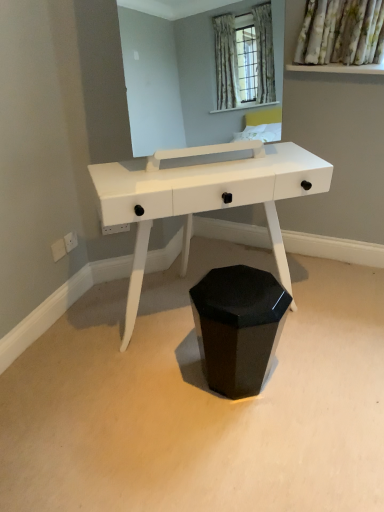
Question: Does white glossy table at center appear on the right side of black glossy hexagonal waste bin at center?

Choices:
 (A) yes
 (B) no

Answer: (B)

Question: Is white glossy table at center outside black glossy hexagonal waste bin at center?

Choices:
 (A) no
 (B) yes

Answer: (B)

Question: From the image's perspective, is white glossy table at center on black glossy hexagonal waste bin at center?

Choices:
 (A) yes
 (B) no

Answer: (A)

Question: Is white glossy table at center oriented away from black glossy hexagonal waste bin at center?

Choices:
 (A) yes
 (B) no

Answer: (B)

Question: Is black glossy hexagonal waste bin at center surrounded by white glossy table at center?

Choices:
 (A) yes
 (B) no

Answer: (B)

Question: Can you confirm if white glossy table at center is bigger than black glossy hexagonal waste bin at center?

Choices:
 (A) no
 (B) yes

Answer: (B)

Question: Considering the relative positions of black glossy hexagonal waste bin at center and white glossy table at center in the image provided, is black glossy hexagonal waste bin at center to the right of white glossy table at center from the viewer's perspective?

Choices:
 (A) yes
 (B) no

Answer: (A)

Question: From a real-world perspective, is black glossy hexagonal waste bin at center located higher than white glossy table at center?

Choices:
 (A) no
 (B) yes

Answer: (A)

Question: From a real-world perspective, is black glossy hexagonal waste bin at center beneath white glossy table at center?

Choices:
 (A) yes
 (B) no

Answer: (A)

Question: Considering the relative positions of black glossy hexagonal waste bin at center and white glossy table at center in the image provided, is black glossy hexagonal waste bin at center to the left of white glossy table at center from the viewer's perspective?

Choices:
 (A) yes
 (B) no

Answer: (B)

Question: Is black glossy hexagonal waste bin at center located outside white glossy table at center?

Choices:
 (A) no
 (B) yes

Answer: (B)

Question: Is white glossy table at center a part of black glossy hexagonal waste bin at center?

Choices:
 (A) no
 (B) yes

Answer: (A)

Question: Is black glossy hexagonal waste bin at center inside the boundaries of white glossy table at center, or outside?

Choices:
 (A) inside
 (B) outside

Answer: (B)